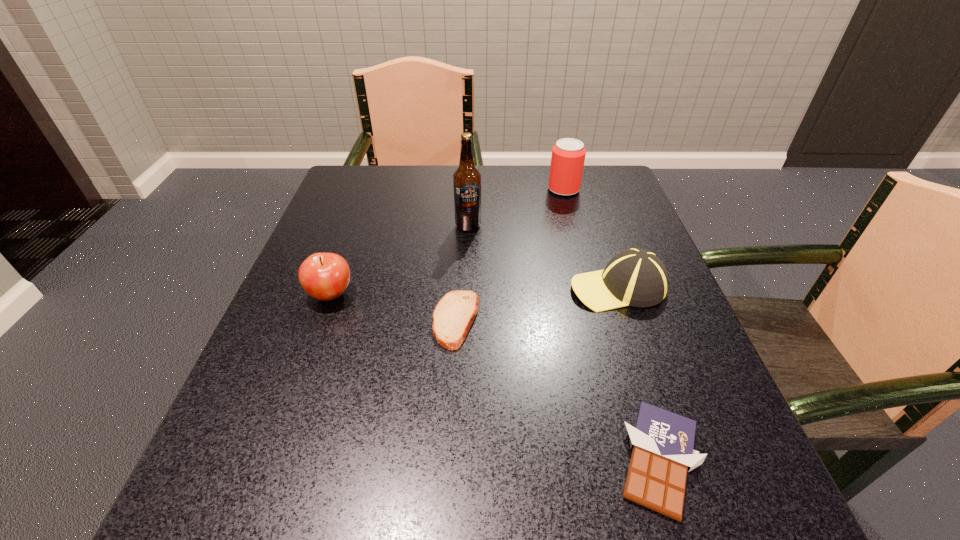
Locate an element on the screen. empty space that is in between the beer bottle and the nearest object is located at coordinates (564, 343).

Find the location of `free spot between the pita bread and the farthest object`. free spot between the pita bread and the farthest object is located at coordinates (510, 254).

You are a GUI agent. You are given a task and a screenshot of the screen. Output one action in this format:
    pyautogui.click(x=<x>, y=<y>)
    Task: Click on the unoccupied position between the chocolate bar and the tallest object
    The width and height of the screenshot is (960, 540).
    Given the screenshot: What is the action you would take?
    pyautogui.click(x=564, y=343)

Locate an element on the screen. Image resolution: width=960 pixels, height=540 pixels. blank region between the fifth shortest object and the second farthest object is located at coordinates (516, 207).

Where is `free space between the pita bread and the fourth tallest object`? The width and height of the screenshot is (960, 540). free space between the pita bread and the fourth tallest object is located at coordinates (537, 303).

Find the location of a particular element. This screenshot has height=540, width=960. free point between the pita bread and the tallest object is located at coordinates (462, 273).

Locate an element on the screen. free space between the apple and the nearest object is located at coordinates (495, 377).

Locate an element on the screen. This screenshot has height=540, width=960. vacant space in between the second farthest object and the pita bread is located at coordinates (462, 273).

I want to click on empty space between the leftmost object and the beer can, so click(x=447, y=242).

The width and height of the screenshot is (960, 540). In order to click on free area in between the chocolate bar and the leftmost object in this screenshot , I will do `click(495, 377)`.